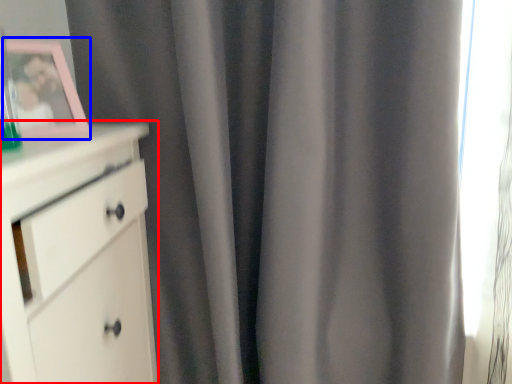
Question: Which object appears farthest to the camera in this image, chest of drawers (highlighted by a red box) or picture frame (highlighted by a blue box)?

Choices:
 (A) chest of drawers
 (B) picture frame

Answer: (B)